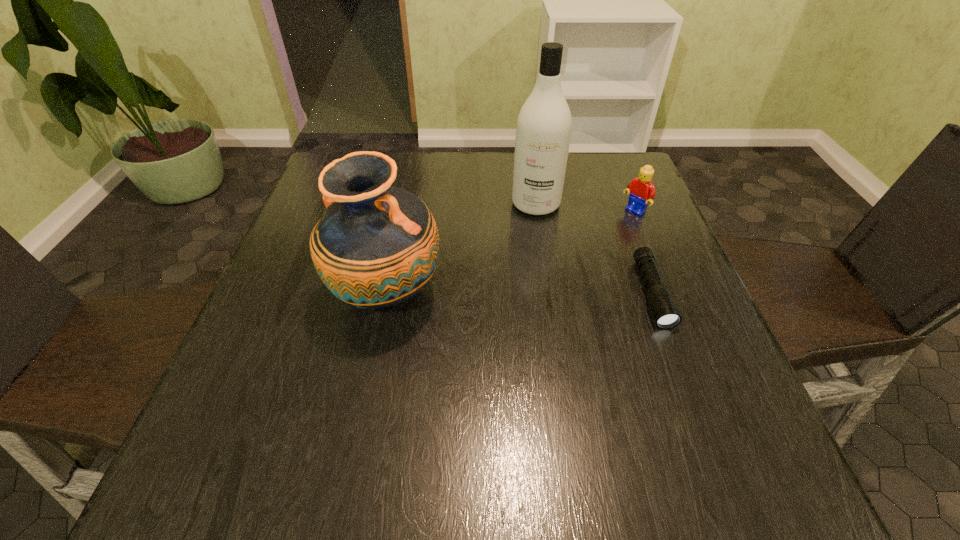
Where is `free space located on the front-facing side of the Lego`? This screenshot has height=540, width=960. free space located on the front-facing side of the Lego is located at coordinates (590, 245).

The width and height of the screenshot is (960, 540). I want to click on vacant space situated on the front-facing side of the shampoo, so click(519, 284).

Where is `free region located on the front-facing side of the shampoo`? The width and height of the screenshot is (960, 540). free region located on the front-facing side of the shampoo is located at coordinates (526, 253).

The width and height of the screenshot is (960, 540). What are the coordinates of `vacant area located on the front-facing side of the shampoo` in the screenshot? It's located at (507, 347).

Where is `object present at the far edge`? The image size is (960, 540). object present at the far edge is located at coordinates (544, 124).

Where is `object located in the left edge section of the desktop`? object located in the left edge section of the desktop is located at coordinates (376, 246).

The width and height of the screenshot is (960, 540). Find the location of `flashlight that is at the right edge`. flashlight that is at the right edge is located at coordinates (666, 315).

At what (x,y) coordinates should I click in order to perform the action: click on Lego situated at the right edge. Please return your answer as a coordinate pair (x, y). Looking at the image, I should click on (641, 189).

Where is `vacant space at the far edge of the desktop`? This screenshot has height=540, width=960. vacant space at the far edge of the desktop is located at coordinates (413, 163).

You are a GUI agent. You are given a task and a screenshot of the screen. Output one action in this format:
    pyautogui.click(x=<x>, y=<y>)
    Task: Click on the free space at the near edge of the desktop
    Image resolution: width=960 pixels, height=540 pixels.
    Given the screenshot: What is the action you would take?
    pyautogui.click(x=478, y=396)